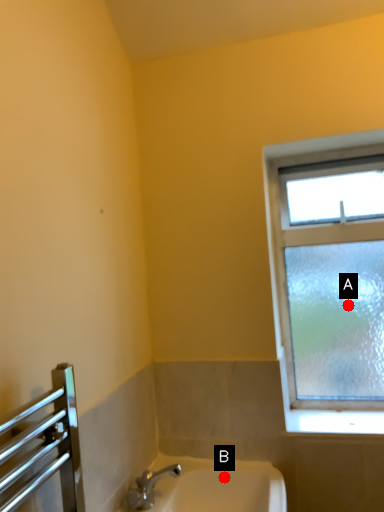
Question: Two points are circled on the image, labeled by A and B beside each circle. Which of the following is the closest to the observer?

Choices:
 (A) A is closer
 (B) B is closer

Answer: (B)